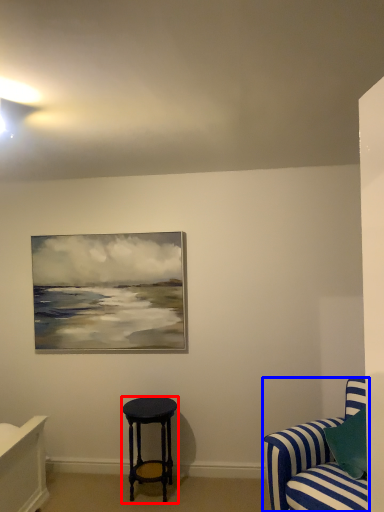
Question: Which of the following is the closest to the observer, stool (highlighted by a red box) or studio couch (highlighted by a blue box)?

Choices:
 (A) stool
 (B) studio couch

Answer: (B)